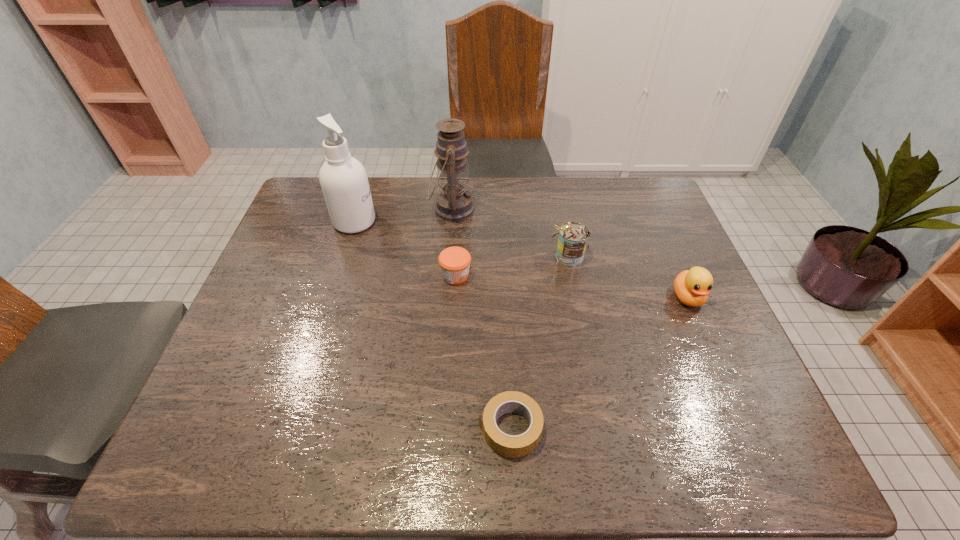
Locate an element on the screen. the leftmost object is located at coordinates (343, 179).

This screenshot has width=960, height=540. What are the coordinates of `oil lamp` in the screenshot? It's located at (454, 203).

Image resolution: width=960 pixels, height=540 pixels. In order to click on can in this screenshot , I will do `click(573, 237)`.

This screenshot has height=540, width=960. Find the location of `the third tallest object`. the third tallest object is located at coordinates (573, 237).

The height and width of the screenshot is (540, 960). What are the coordinates of `the fourth tallest object` in the screenshot? It's located at (692, 287).

Find the location of a particular element. The height and width of the screenshot is (540, 960). duckling is located at coordinates (692, 287).

You are a GUI agent. You are given a task and a screenshot of the screen. Output one action in this format:
    pyautogui.click(x=<x>, y=<y>)
    Task: Click on the second shortest object
    
    Given the screenshot: What is the action you would take?
    pyautogui.click(x=454, y=262)

Where is `the third object from right to left`? The image size is (960, 540). the third object from right to left is located at coordinates (506, 445).

Where is `the shortest object`? The width and height of the screenshot is (960, 540). the shortest object is located at coordinates (506, 445).

Where is `vacant area located on the front label of the cleansing agent`? Image resolution: width=960 pixels, height=540 pixels. vacant area located on the front label of the cleansing agent is located at coordinates (448, 221).